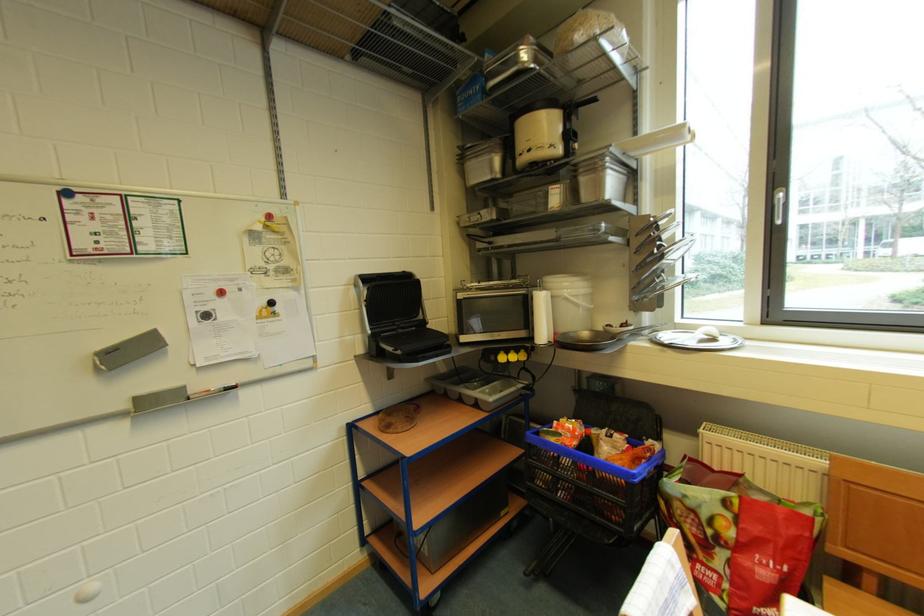
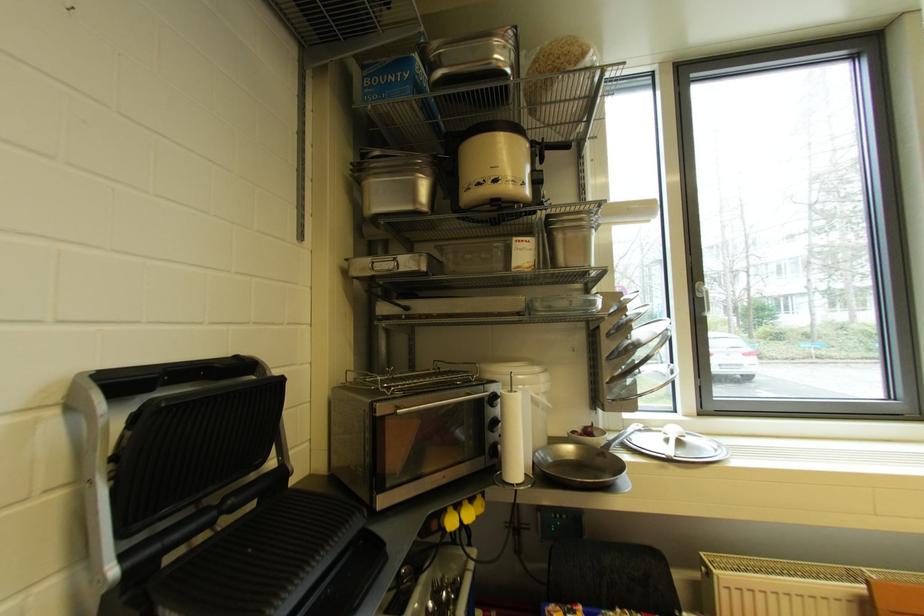
Locate, in the second image, the point that corresponds to point (730, 339) in the first image.

(695, 437)